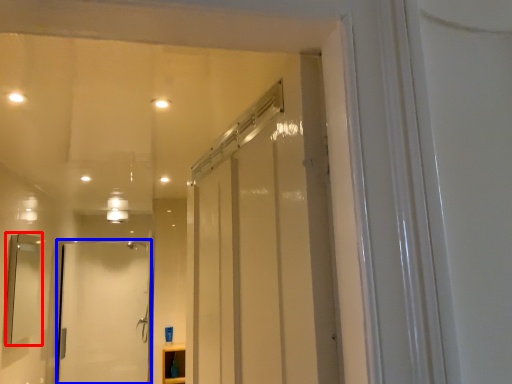
Question: Which point is closer to the camera, mirror (highlighted by a red box) or door (highlighted by a blue box)?

Choices:
 (A) mirror
 (B) door

Answer: (A)